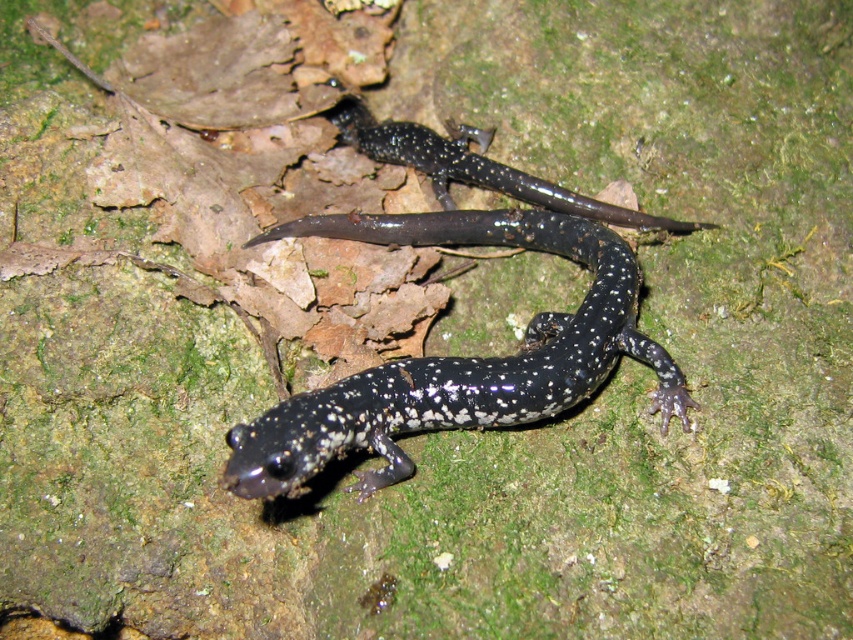
You are a nature photographer aiming to capture both the shiny black salamander at center and the speckled glossy salamander at center in a single frame. Since you want to ensure both are fully visible, which salamander should you focus on first to account for their sizes?

The shiny black salamander at center is taller than the speckled glossy salamander at center, so you should focus on the taller one first to ensure proper focus on both.

You are a wildlife photographer aiming to capture both the shiny black salamander at center and the speckled glossy salamander at center in a single frame. Given that your camera has a fixed focal length and a limited field of view, which salamander should you focus on to ensure both fit in the frame without moving the camera?

You should focus on the speckled glossy salamander at center because the shiny black salamander at center is wider. By centering the narrower speckled glossy salamander at center, there will be enough space to include the wider shiny black salamander at center within the frame.